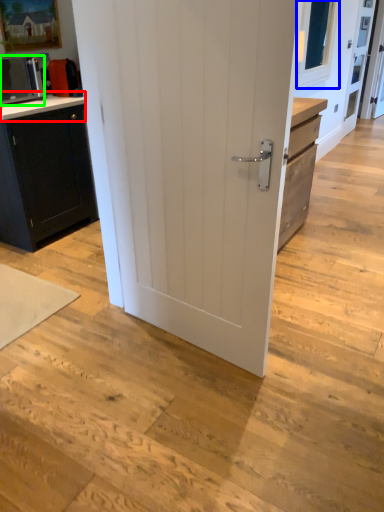
Question: Considering the real-world distances, which object is closest to counter top (highlighted by a red box)? window screen (highlighted by a blue box) or home appliance (highlighted by a green box).

Choices:
 (A) window screen
 (B) home appliance

Answer: (B)